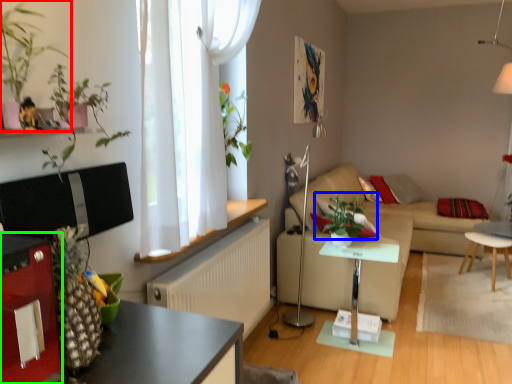
Question: Which is farther away from houseplant (highlighted by a red box)? plant (highlighted by a blue box) or cabinetry (highlighted by a green box)?

Choices:
 (A) plant
 (B) cabinetry

Answer: (A)